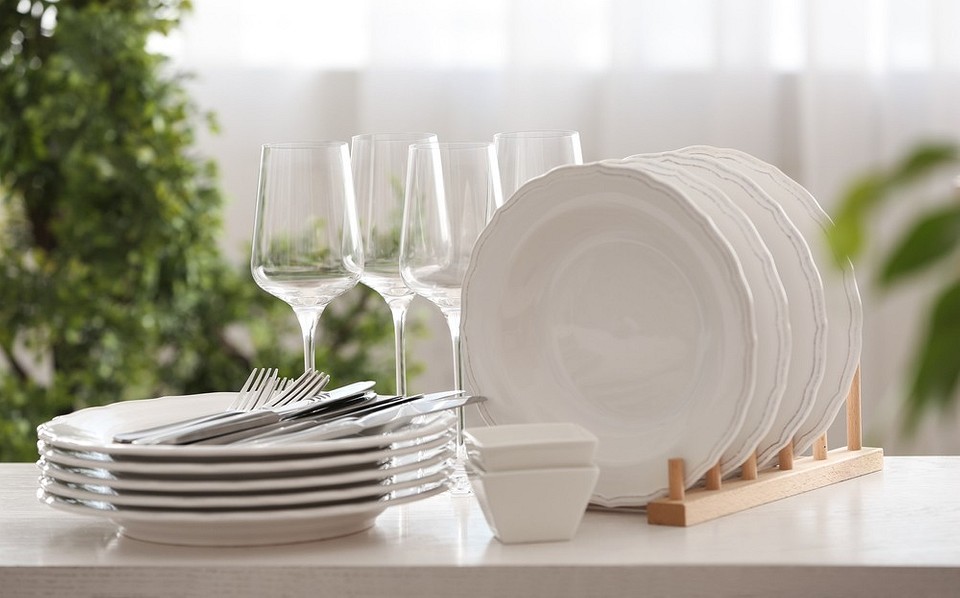
Identify the location of plates. Image resolution: width=960 pixels, height=598 pixels. (280, 520), (274, 504), (272, 485), (271, 463), (276, 444), (744, 376), (766, 380), (798, 369), (832, 368).